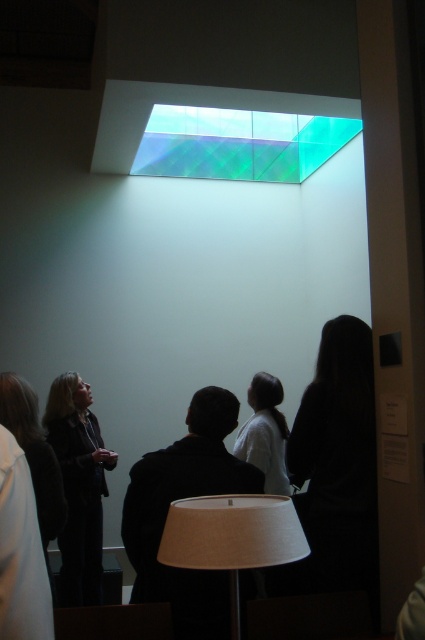
You are a fashion designer observing the scene and notice the dark brown leather jacket at lower left and the dark brown hair at left. Which object is taller in the image?

The dark brown leather jacket at lower left is taller than dark brown hair at left.